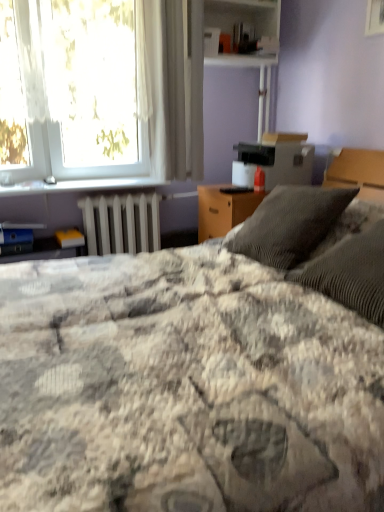
Question: From a real-world perspective, does white sheer curtain at upper center sit lower than fluffy gray blanket at center?

Choices:
 (A) no
 (B) yes

Answer: (A)

Question: From a real-world perspective, does white sheer curtain at upper center stand above fluffy gray blanket at center?

Choices:
 (A) no
 (B) yes

Answer: (B)

Question: Can you confirm if white sheer curtain at upper center is positioned to the left of fluffy gray blanket at center?

Choices:
 (A) no
 (B) yes

Answer: (B)

Question: Is white sheer curtain at upper center thinner than fluffy gray blanket at center?

Choices:
 (A) no
 (B) yes

Answer: (B)

Question: Does white sheer curtain at upper center appear on the right side of fluffy gray blanket at center?

Choices:
 (A) no
 (B) yes

Answer: (A)

Question: From the image's perspective, is white sheer curtain at upper center located beneath fluffy gray blanket at center?

Choices:
 (A) no
 (B) yes

Answer: (A)

Question: Does white metallic radiator at lower left have a larger size compared to white sheer curtain at upper center?

Choices:
 (A) yes
 (B) no

Answer: (B)

Question: Considering the relative sizes of white metallic radiator at lower left and white sheer curtain at upper center in the image provided, is white metallic radiator at lower left taller than white sheer curtain at upper center?

Choices:
 (A) yes
 (B) no

Answer: (B)

Question: Is white metallic radiator at lower left at the left side of white sheer curtain at upper center?

Choices:
 (A) yes
 (B) no

Answer: (A)

Question: Does white metallic radiator at lower left come in front of white sheer curtain at upper center?

Choices:
 (A) yes
 (B) no

Answer: (B)

Question: From the image's perspective, is white metallic radiator at lower left above white sheer curtain at upper center?

Choices:
 (A) no
 (B) yes

Answer: (A)

Question: Is white metallic radiator at lower left to the right of white sheer curtain at upper center from the viewer's perspective?

Choices:
 (A) yes
 (B) no

Answer: (B)

Question: Is white sheer curtain at upper center thinner than metallic silver window sill at upper left?

Choices:
 (A) no
 (B) yes

Answer: (B)